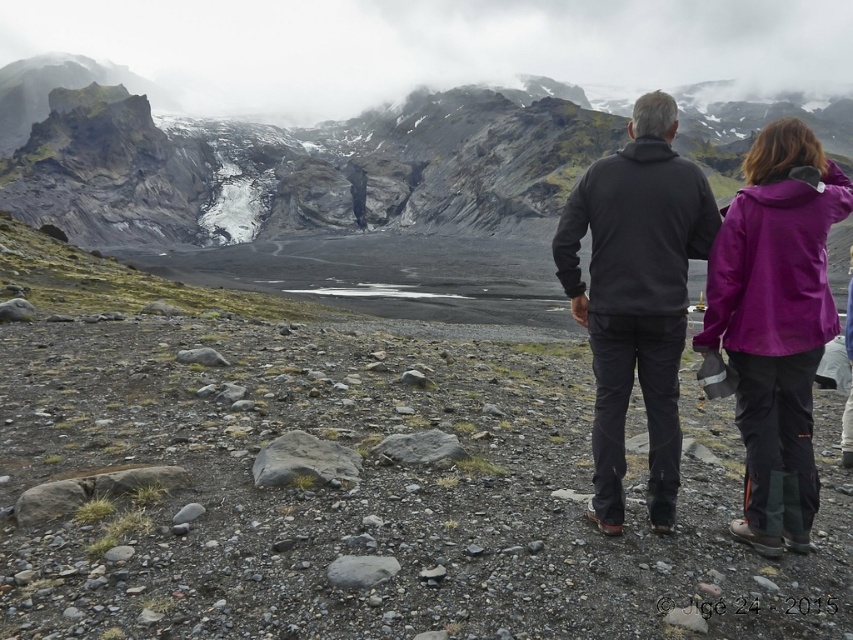
Question: Is rugged rock mountain at upper center wider than purple waterproof jacket at upper right?

Choices:
 (A) no
 (B) yes

Answer: (B)

Question: Which point appears closest to the camera in this image?

Choices:
 (A) (62, 74)
 (B) (646, 141)
 (C) (795, 316)

Answer: (C)

Question: Can you confirm if dark gray fleece jacket at center is positioned above purple waterproof jacket at upper right?

Choices:
 (A) yes
 (B) no

Answer: (A)

Question: Estimate the real-world distances between objects in this image. Which object is closer to the dark gray fleece jacket at center?

Choices:
 (A) purple waterproof jacket at upper right
 (B) rugged rock mountain at upper center

Answer: (A)

Question: Which point appears farthest from the camera in this image?

Choices:
 (A) (39, 72)
 (B) (750, 348)
 (C) (677, 310)

Answer: (A)

Question: Is rugged rock mountain at upper center positioned in front of dark gray fleece jacket at center?

Choices:
 (A) yes
 (B) no

Answer: (B)